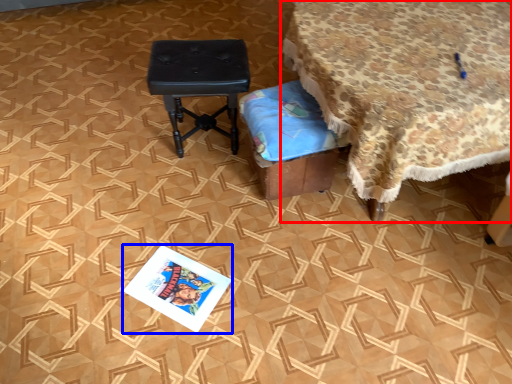
Question: Among these objects, which one is nearest to the camera, table (highlighted by a red box) or magazine (highlighted by a blue box)?

Choices:
 (A) table
 (B) magazine

Answer: (A)